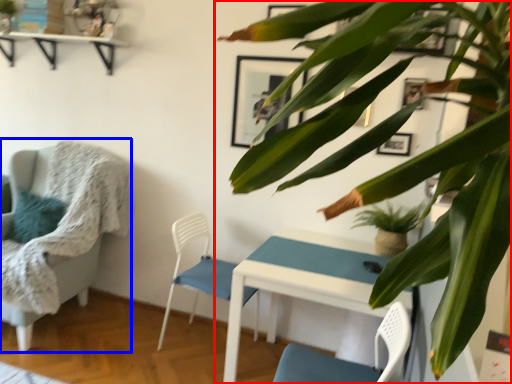
Question: Which object is further to the camera taking this photo, houseplant (highlighted by a red box) or chair (highlighted by a blue box)?

Choices:
 (A) houseplant
 (B) chair

Answer: (B)